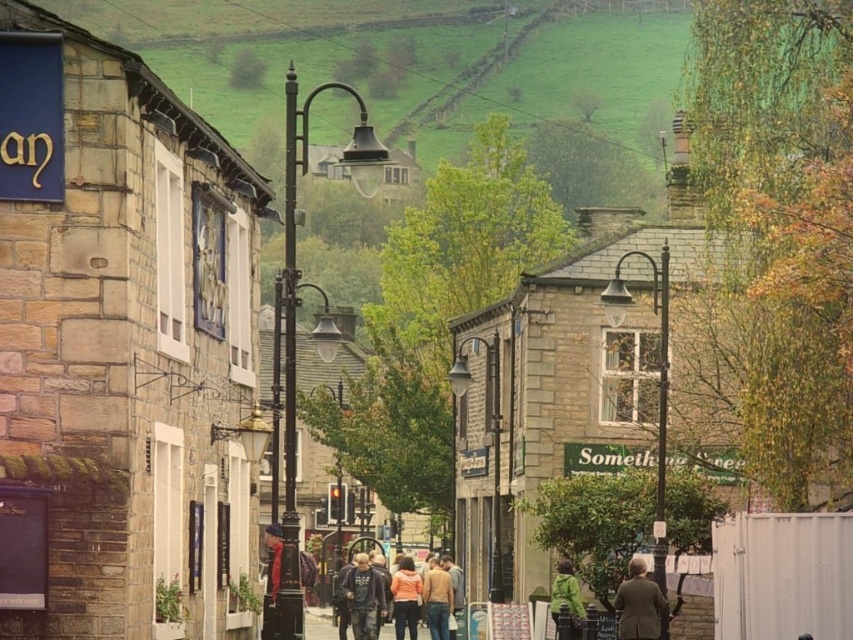
Question: Is stone building at left smaller than light brown sweater at center?

Choices:
 (A) yes
 (B) no

Answer: (B)

Question: Among these objects, which one is nearest to the camera?

Choices:
 (A) dark blue hoodie at center
 (B) matte orange sweater at center
 (C) light brown sweater at center
 (D) light brown wool coat at lower center

Answer: (D)

Question: Which object is positioned closest to the stone building at left?

Choices:
 (A) green matte jacket at lower center
 (B) light brown wool coat at lower center
 (C) light brown sweater at center

Answer: (B)

Question: Which of these objects is positioned closest to the matte orange sweater at center?

Choices:
 (A) light brown sweater at center
 (B) green matte jacket at lower center

Answer: (A)

Question: Is dark blue hoodie at center closer to the viewer compared to matte orange sweater at center?

Choices:
 (A) yes
 (B) no

Answer: (A)

Question: Can you confirm if light brown wool coat at lower center is smaller than light brown sweater at center?

Choices:
 (A) yes
 (B) no

Answer: (A)